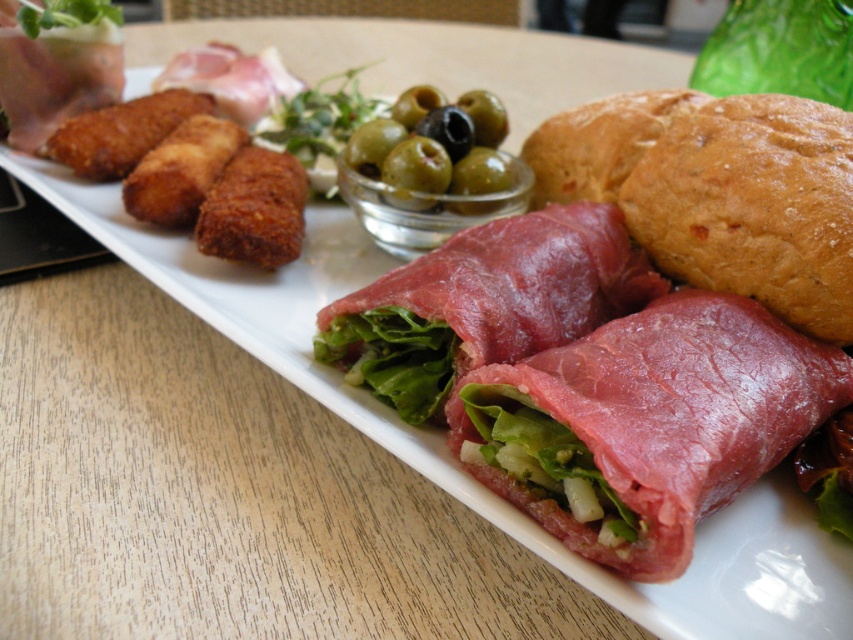
You are a food critic examining the charcuterie platter. You notice the pink glossy meat at center and the green glossy olives at center. Which of these two items is positioned closer to you?

The pink glossy meat at center is closer to the viewer than the green glossy olives at center.